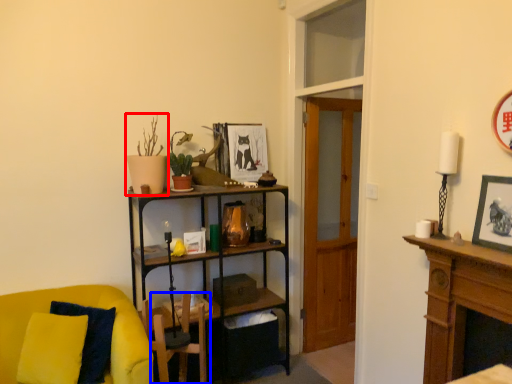
Question: Among these objects, which one is farthest to the camera, houseplant (highlighted by a red box) or swivel chair (highlighted by a blue box)?

Choices:
 (A) houseplant
 (B) swivel chair

Answer: (A)